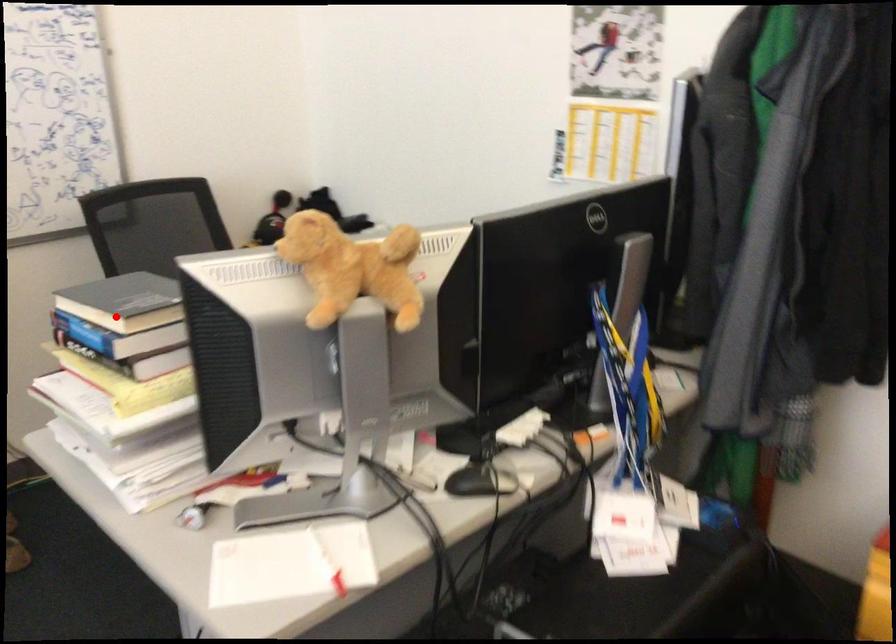
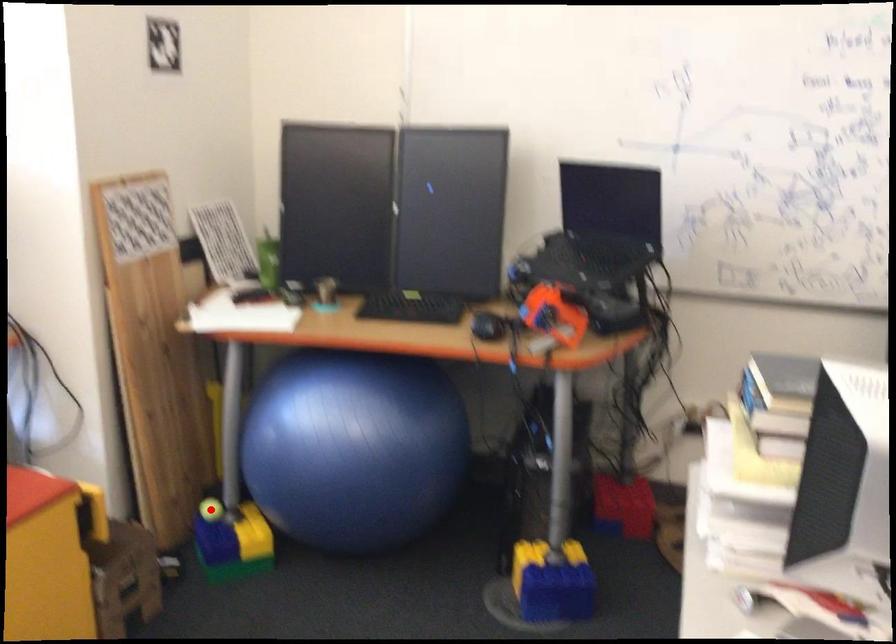
I am providing you with two images of the same scene from different viewpoints. A red point is marked on the first image and another point is marked on the second image. Is the marked point in image1 the same physical position as the marked point in image2?

No